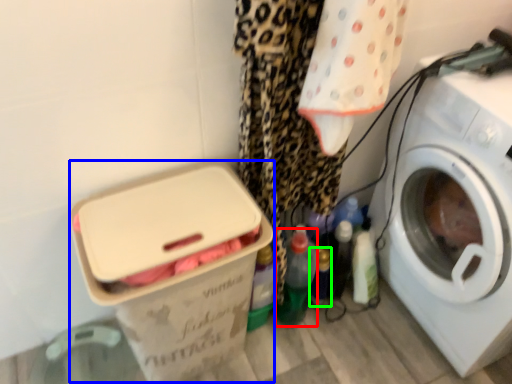
Question: Which object is positioned farthest from bottle (highlighted by a red box)? Select from box (highlighted by a blue box) and bottle (highlighted by a green box).

Choices:
 (A) box
 (B) bottle

Answer: (A)